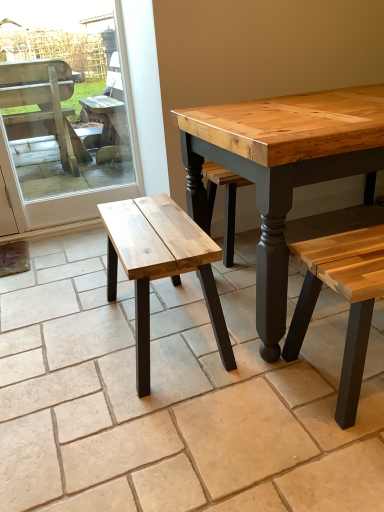
Question: From a real-world perspective, is wooden bench at left over natural wood bench at center?

Choices:
 (A) yes
 (B) no

Answer: (A)

Question: Is natural wood bench at center at the back of wooden bench at left?

Choices:
 (A) no
 (B) yes

Answer: (A)

Question: Does wooden bench at left have a lesser height compared to natural wood bench at center?

Choices:
 (A) yes
 (B) no

Answer: (B)

Question: Is wooden bench at left not close to natural wood bench at center?

Choices:
 (A) yes
 (B) no

Answer: (A)

Question: From the image's perspective, is wooden bench at left below natural wood bench at center?

Choices:
 (A) yes
 (B) no

Answer: (B)

Question: Is wooden bench at left closer to the viewer compared to natural wood bench at center?

Choices:
 (A) no
 (B) yes

Answer: (A)

Question: From a real-world perspective, does natural wood bench at center stand above wooden bench at left?

Choices:
 (A) no
 (B) yes

Answer: (A)

Question: Is natural wood bench at center further to camera compared to wooden bench at left?

Choices:
 (A) yes
 (B) no

Answer: (B)

Question: Can you confirm if natural wood bench at center is thinner than wooden bench at left?

Choices:
 (A) yes
 (B) no

Answer: (B)

Question: Considering the relative sizes of natural wood bench at center and wooden bench at left in the image provided, is natural wood bench at center taller than wooden bench at left?

Choices:
 (A) yes
 (B) no

Answer: (B)

Question: Does natural wood bench at center have a smaller size compared to wooden bench at left?

Choices:
 (A) no
 (B) yes

Answer: (A)

Question: Considering the relative sizes of natural wood bench at center and wooden bench at left in the image provided, is natural wood bench at center wider than wooden bench at left?

Choices:
 (A) yes
 (B) no

Answer: (A)

Question: Considering the relative positions of natural wood bench at center and wooden bench at left in the image provided, is natural wood bench at center to the left or to the right of wooden bench at left?

Choices:
 (A) right
 (B) left

Answer: (A)